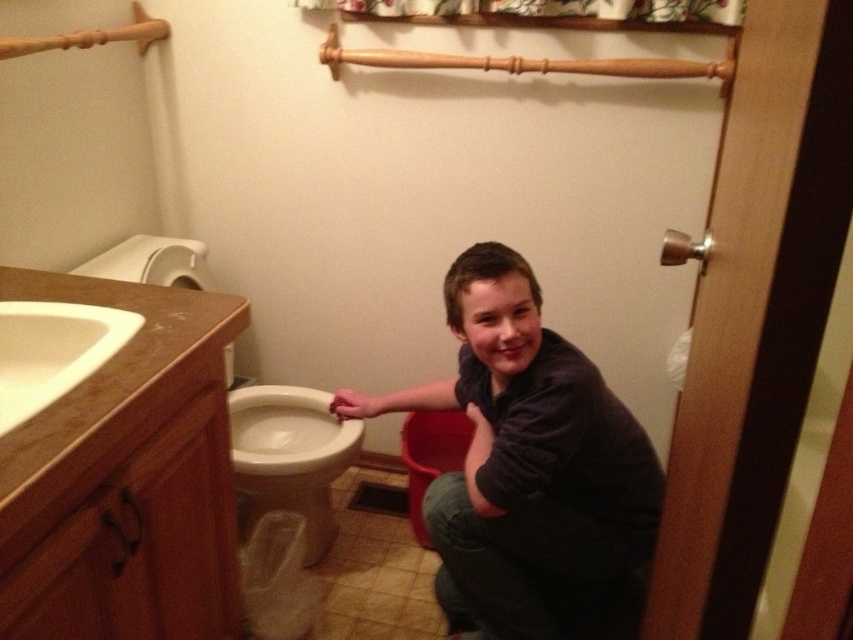
You are a parent trying to clean the bathroom. You see the dark blue fabric at center and the white glossy toilet bowl at lower left. Which object is easier to reach without moving your position?

The dark blue fabric at center is closer to the viewer than the white glossy toilet bowl at lower left, so it is easier to reach without moving.

Based on the scene description, where is the dark blue fabric at center located in terms of coordinates?

The dark blue fabric at center is located at coordinates point (525, 460).